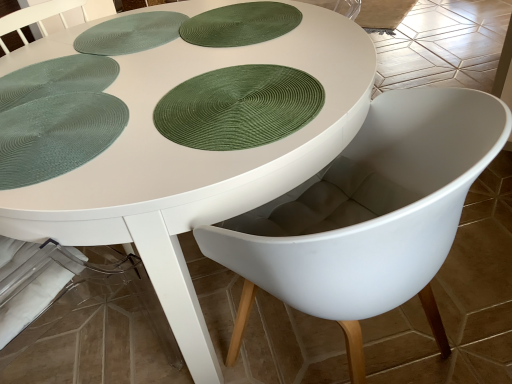
Where is `vacant region in front of green textured placemat at upper left`? The image size is (512, 384). vacant region in front of green textured placemat at upper left is located at coordinates (142, 75).